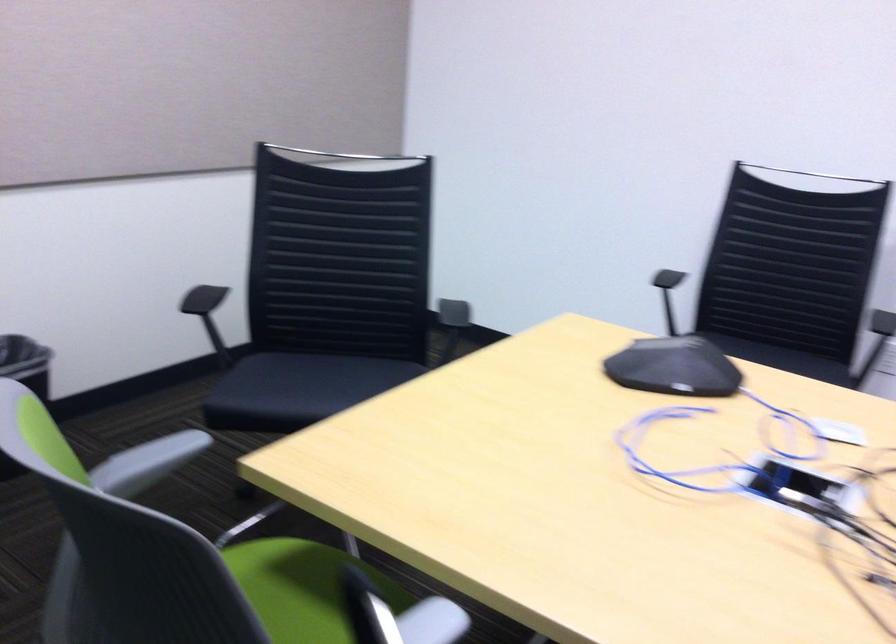
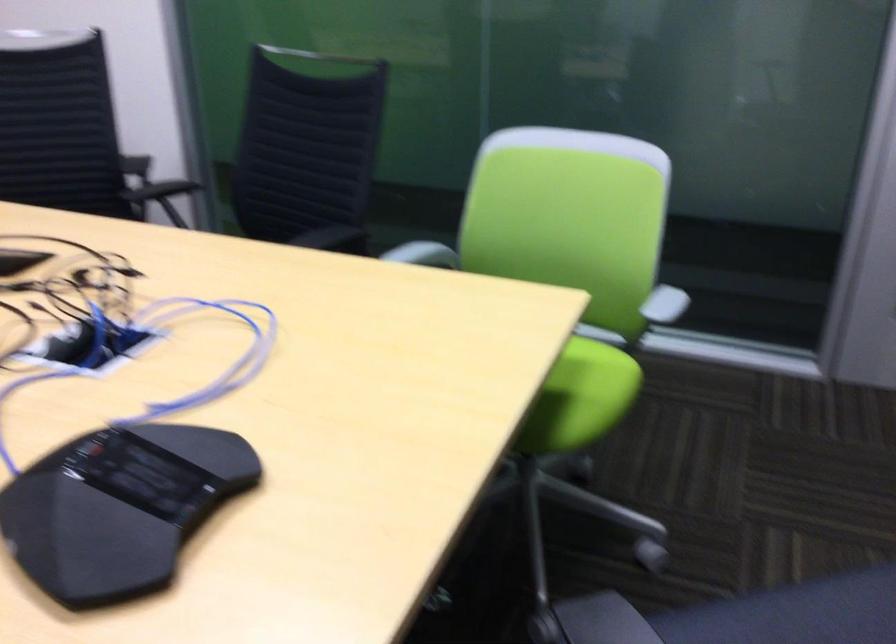
In the second image, find the point that corresponds to (150,440) in the first image.

(659, 310)